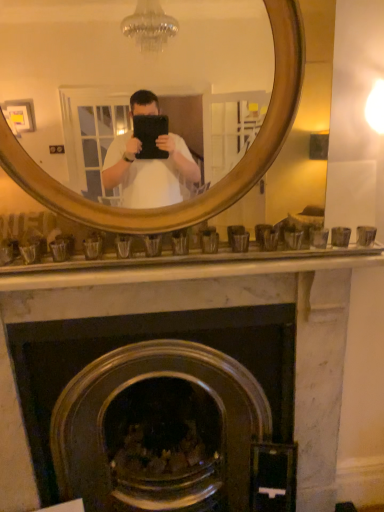
Question: Can you confirm if wooden mirror at upper center is wider than marble fireplace at center?

Choices:
 (A) yes
 (B) no

Answer: (B)

Question: Can you confirm if wooden mirror at upper center is smaller than marble fireplace at center?

Choices:
 (A) no
 (B) yes

Answer: (B)

Question: Is wooden mirror at upper center at the left side of marble fireplace at center?

Choices:
 (A) no
 (B) yes

Answer: (A)

Question: From a real-world perspective, is wooden mirror at upper center located higher than marble fireplace at center?

Choices:
 (A) no
 (B) yes

Answer: (B)

Question: Is wooden mirror at upper center at the right side of marble fireplace at center?

Choices:
 (A) yes
 (B) no

Answer: (A)

Question: Does wooden mirror at upper center have a larger size compared to marble fireplace at center?

Choices:
 (A) no
 (B) yes

Answer: (A)

Question: Is marble fireplace at center positioned before wooden mirror at upper center?

Choices:
 (A) no
 (B) yes

Answer: (A)

Question: From the image's perspective, does marble fireplace at center appear lower than wooden mirror at upper center?

Choices:
 (A) no
 (B) yes

Answer: (B)

Question: From a real-world perspective, is marble fireplace at center located beneath wooden mirror at upper center?

Choices:
 (A) no
 (B) yes

Answer: (B)

Question: From the image's perspective, is marble fireplace at center located above wooden mirror at upper center?

Choices:
 (A) yes
 (B) no

Answer: (B)

Question: Is marble fireplace at center at the right side of wooden mirror at upper center?

Choices:
 (A) no
 (B) yes

Answer: (A)

Question: Is marble fireplace at center wider than wooden mirror at upper center?

Choices:
 (A) yes
 (B) no

Answer: (A)

Question: From the image's perspective, relative to marble fireplace at center, is wooden mirror at upper center above or below?

Choices:
 (A) below
 (B) above

Answer: (B)